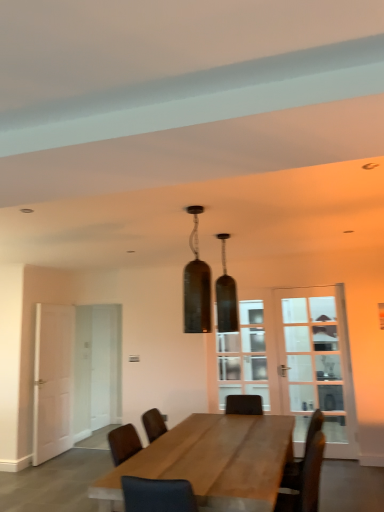
Image resolution: width=384 pixels, height=512 pixels. Identify the location of free point above matte glass pendant light at center, arranged as the first lamp when viewed from the front (from a real-world perspective). click(x=201, y=204).